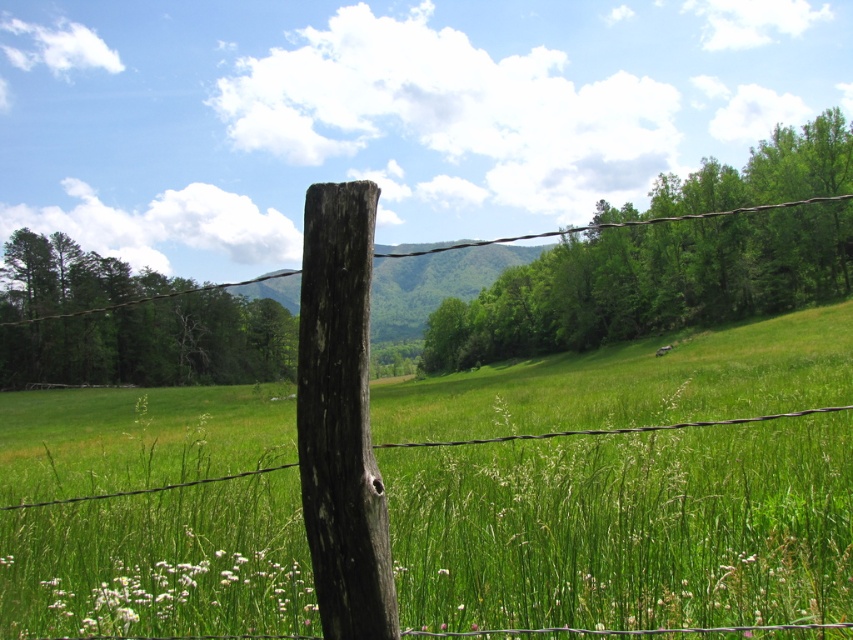
Measure the distance between weathered wood post at center and camera.

weathered wood post at center and camera are 1.94 meters apart.

Does weathered wood post at center have a smaller size compared to brown wooden wire at center?

Yes.

Is point (308, 461) farther from viewer compared to point (231, 282)?

No, (308, 461) is closer to viewer.

The width and height of the screenshot is (853, 640). I want to click on weathered wood post at center, so click(x=341, y=417).